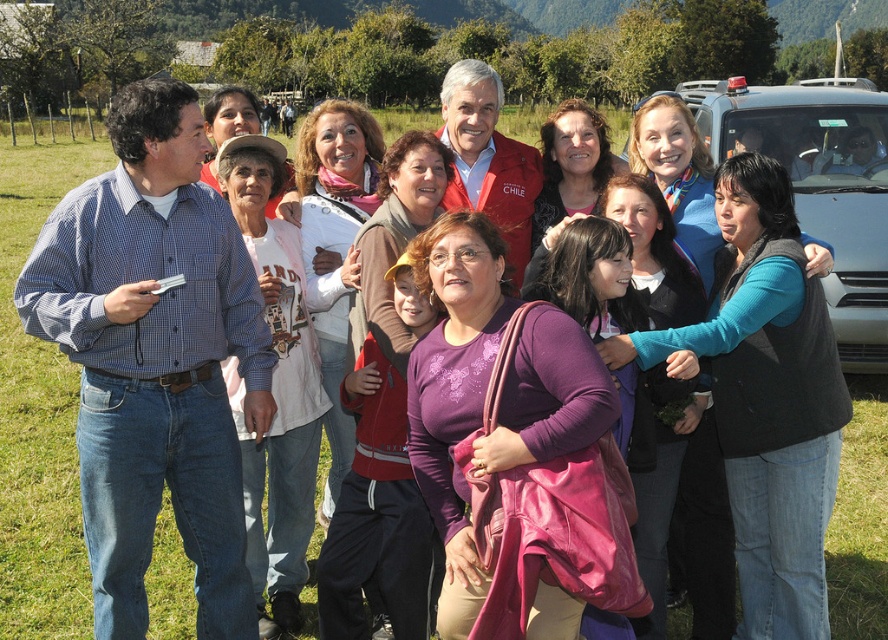
You are taking a photo of the group and notice two points in the image labeled as point 1 at coordinates point 1 at coordinates point (238, 534) and point 2 at coordinates point (680, 83). Which point is nearer to the camera?

Point (238, 534) is closer to the camera than point (680, 83).

You are a photographer standing in the middle of the group. You want to take a photo that includes both the blue checkered shirt at left and the metallic silver car at right. Can you position yourself so that both are in the frame without moving any objects? Explain your reasoning.

The blue checkered shirt at left and the metallic silver car at right are 4.33 meters apart. Since the photographer is in the middle of the group, they can likely position themselves to include both in the frame as 4.33 meters is a manageable distance for a standard camera lens to capture both subjects without needing to move objects.